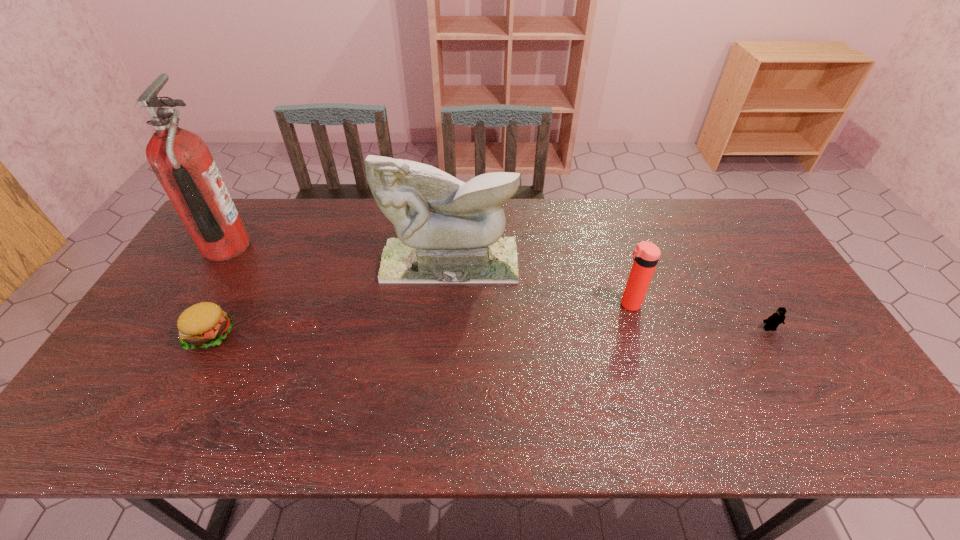
In the image, there is a desktop. Where is `vacant space at the left edge`? vacant space at the left edge is located at coordinates (150, 360).

Locate an element on the screen. The height and width of the screenshot is (540, 960). vacant space at the right edge of the desktop is located at coordinates (798, 303).

The width and height of the screenshot is (960, 540). Find the location of `vacant position at the far left corner of the desktop`. vacant position at the far left corner of the desktop is located at coordinates (248, 225).

I want to click on free space between the hamburger and the rightmost object, so point(490,332).

Identify the location of unoccupied area between the rightmost object and the hamburger. This screenshot has height=540, width=960. (490, 332).

Locate an element on the screen. empty space that is in between the Lego and the tallest object is located at coordinates (497, 288).

What are the coordinates of `empty location between the Lego and the sculpture` in the screenshot? It's located at (610, 295).

Where is `unoccupied area between the third shortest object and the rightmost object`? The width and height of the screenshot is (960, 540). unoccupied area between the third shortest object and the rightmost object is located at coordinates (699, 316).

Where is `free space between the Lego and the sculpture`? The height and width of the screenshot is (540, 960). free space between the Lego and the sculpture is located at coordinates (610, 295).

Identify the location of blank region between the fourth object from left to right and the hamburger. Image resolution: width=960 pixels, height=540 pixels. (420, 320).